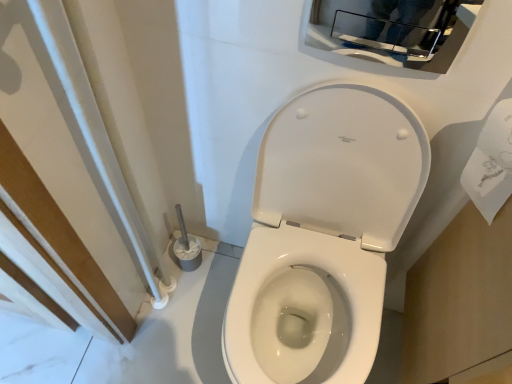
Locate an element on the screen. The width and height of the screenshot is (512, 384). glossy chrome medicine cabinet at upper center is located at coordinates (392, 31).

What do you see at coordinates (323, 236) in the screenshot?
I see `white glossy toilet at center` at bounding box center [323, 236].

Image resolution: width=512 pixels, height=384 pixels. In order to click on glossy chrome medicine cabinet at upper center in this screenshot , I will do `click(392, 31)`.

Which is behind, white paper towel at right or white glossy toilet at center?

white paper towel at right is behind.

Can you confirm if white paper towel at right is shorter than white glossy toilet at center?

Yes.

What's the angular difference between white paper towel at right and white glossy toilet at center's facing directions?

The facing directions of white paper towel at right and white glossy toilet at center are 0.059 degrees apart.

Is white glossy toilet at center positioned in front of glossy chrome medicine cabinet at upper center?

Yes, the depth of white glossy toilet at center is less than that of glossy chrome medicine cabinet at upper center.

How many degrees apart are the facing directions of white glossy toilet at center and glossy chrome medicine cabinet at upper center?

The facing directions of white glossy toilet at center and glossy chrome medicine cabinet at upper center are 1.09 degrees apart.

Is white glossy toilet at center thinner than glossy chrome medicine cabinet at upper center?

Incorrect, the width of white glossy toilet at center is not less than that of glossy chrome medicine cabinet at upper center.

Is white glossy toilet at center looking in the opposite direction of glossy chrome medicine cabinet at upper center?

No, white glossy toilet at center is not facing away from glossy chrome medicine cabinet at upper center.

In the image, there is a white paper towel at right. Identify the location of medicine cabinet above it (from the image's perspective). (392, 31).

Which is behind, glossy chrome medicine cabinet at upper center or white paper towel at right?

glossy chrome medicine cabinet at upper center is further away from the camera.

Who is shorter, glossy chrome medicine cabinet at upper center or white paper towel at right?

glossy chrome medicine cabinet at upper center is shorter.

From their relative heights in the image, would you say white paper towel at right is taller or shorter than glossy chrome medicine cabinet at upper center?

Considering their sizes, white paper towel at right has more height than glossy chrome medicine cabinet at upper center.

From the image's perspective, would you say white paper towel at right is positioned over glossy chrome medicine cabinet at upper center?

No, from the image's perspective, white paper towel at right is not above glossy chrome medicine cabinet at upper center.

Which object is closer to the camera, white paper towel at right or glossy chrome medicine cabinet at upper center?

white paper towel at right is more forward.

Between white paper towel at right and glossy chrome medicine cabinet at upper center, which one appears on the left side from the viewer's perspective?

From the viewer's perspective, glossy chrome medicine cabinet at upper center appears more on the left side.

How distant is white glossy toilet at center from white paper towel at right?

A distance of 15.48 inches exists between white glossy toilet at center and white paper towel at right.

Between white glossy toilet at center and white paper towel at right, which one has smaller width?

Thinner between the two is white paper towel at right.

From the image's perspective, is white glossy toilet at center above or below white paper towel at right?

white glossy toilet at center is situated lower than white paper towel at right in the image.

Who is shorter, white glossy toilet at center or white paper towel at right?

Standing shorter between the two is white paper towel at right.

Measure the distance from glossy chrome medicine cabinet at upper center to white glossy toilet at center.

17.02 inches.

Consider the image. From the image's perspective, is glossy chrome medicine cabinet at upper center under white glossy toilet at center?

No, from the image's perspective, glossy chrome medicine cabinet at upper center is not below white glossy toilet at center.

Is glossy chrome medicine cabinet at upper center at the right side of white glossy toilet at center?

Correct, you'll find glossy chrome medicine cabinet at upper center to the right of white glossy toilet at center.

Is glossy chrome medicine cabinet at upper center positioned with its back to white glossy toilet at center?

glossy chrome medicine cabinet at upper center does not have its back to white glossy toilet at center.

At what (x,y) coordinates should I click in order to perform the action: click on toilet that appears on the left of white paper towel at right. Please return your answer as a coordinate pair (x, y). Looking at the image, I should click on (323, 236).

I want to click on medicine cabinet above the white glossy toilet at center (from the image's perspective), so click(392, 31).

Based on their spatial positions, is white glossy toilet at center or white paper towel at right further from glossy chrome medicine cabinet at upper center?

white glossy toilet at center.

Estimate the real-world distances between objects in this image. Which object is further from white paper towel at right, glossy chrome medicine cabinet at upper center or white glossy toilet at center?

Among the two, white glossy toilet at center is located further to white paper towel at right.

Based on their spatial positions, is white paper towel at right or glossy chrome medicine cabinet at upper center further from white glossy toilet at center?

glossy chrome medicine cabinet at upper center lies further to white glossy toilet at center than the other object.

Looking at the image, which one is located further to white paper towel at right, white glossy toilet at center or glossy chrome medicine cabinet at upper center?

white glossy toilet at center lies further to white paper towel at right than the other object.

Estimate the real-world distances between objects in this image. Which object is further from white glossy toilet at center, glossy chrome medicine cabinet at upper center or white paper towel at right?

glossy chrome medicine cabinet at upper center is positioned further to the anchor white glossy toilet at center.

When comparing their distances from glossy chrome medicine cabinet at upper center, does white paper towel at right or white glossy toilet at center seem further?

Among the two, white glossy toilet at center is located further to glossy chrome medicine cabinet at upper center.

Identify the location of toilet paper between glossy chrome medicine cabinet at upper center and white glossy toilet at center in the vertical direction. (490, 162).